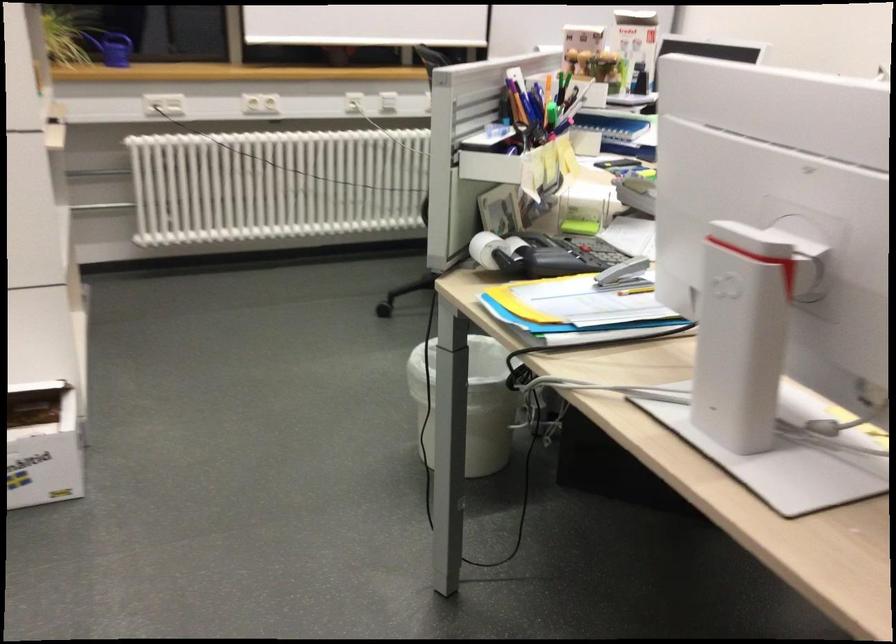
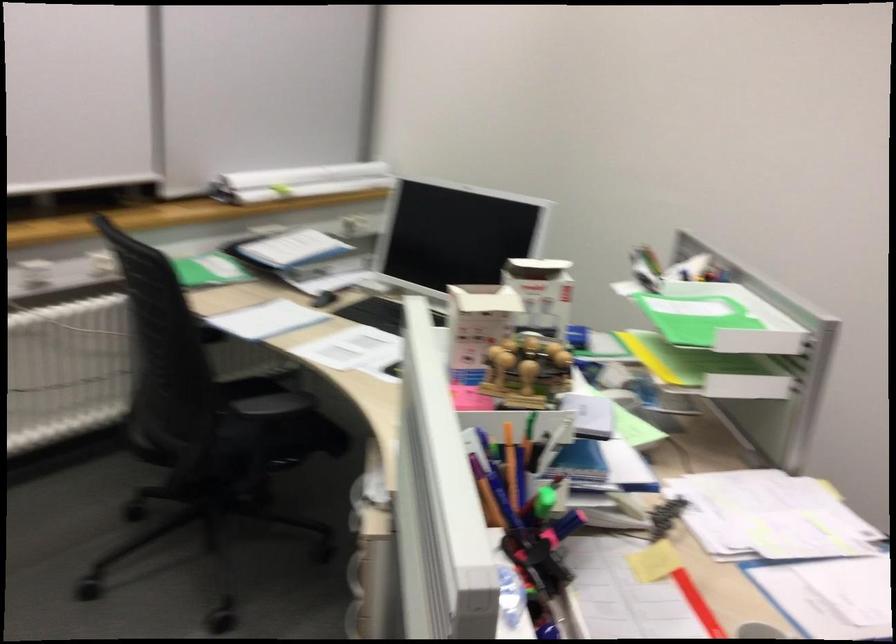
Which direction would the cameraman need to move to produce the second image?

The cameraman moved toward left, forward.